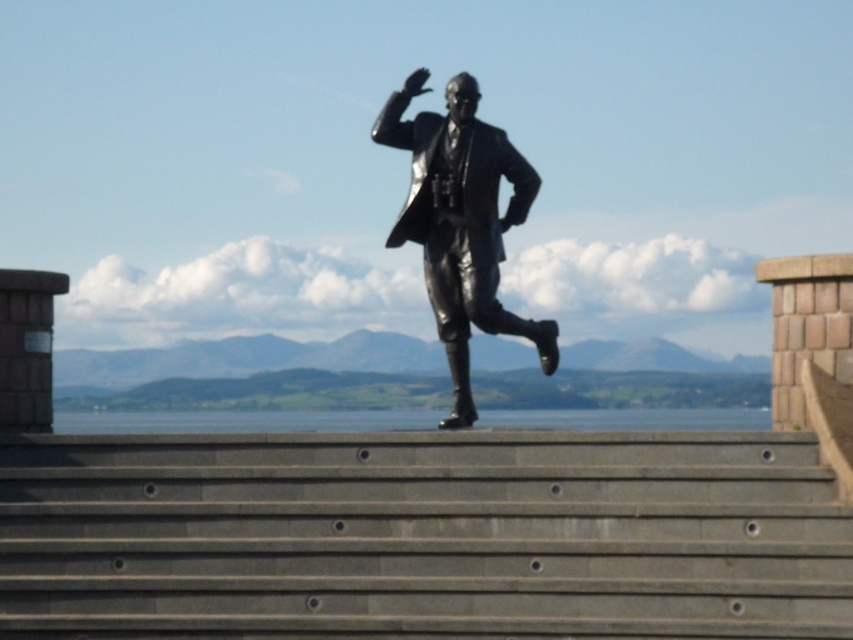
You are standing at the bottom of the gray concrete stairs at center and want to reach the shiny bronze statue at center. Which direction should you move towards?

You should move to the right because the gray concrete stairs at center are to the left of the shiny bronze statue at center, so moving right would lead you towards the statue.

You are standing in front of the bronze statue and want to take a photo. You notice two points marked on the statue. Which point, point (560, 582) or point (651, 410), is closer to your camera lens?

Point (560, 582) is closer to the camera than point (651, 410).

You are standing at the base of the stone steps leading to the bronze statue. You notice two points marked on the steps. The first point is at coordinate point [486,125], and the second is at point [352,426]. If you want to reach the statue by stepping on both points, which point should you step on first?

You should step on point [486,125] first because it is in front of point [352,426] on the stone steps leading up to the statue.